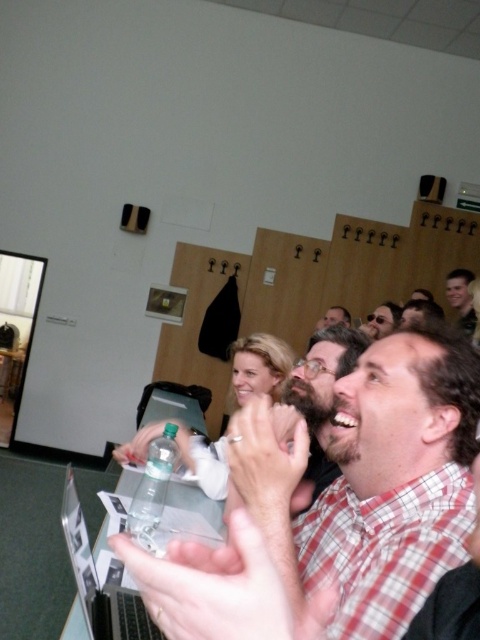
Question: Which of the following is the closest to the observer?

Choices:
 (A) (175, 483)
 (B) (376, 326)
 (C) (452, 307)

Answer: (A)

Question: Does silver metallic laptop at center have a greater width compared to light brown hair at upper right?

Choices:
 (A) yes
 (B) no

Answer: (B)

Question: Can you confirm if plaid shirt at center is smaller than matte black sunglasses at upper center?

Choices:
 (A) yes
 (B) no

Answer: (B)

Question: Which object appears closest to the camera in this image?

Choices:
 (A) silver metallic laptop at center
 (B) matte black sunglasses at upper center
 (C) plaid shirt at center

Answer: (C)

Question: Which object appears closest to the camera in this image?

Choices:
 (A) plaid shirt at center
 (B) silver metallic laptop at center

Answer: (A)

Question: Does plaid shirt at center appear under silver metallic laptop at center?

Choices:
 (A) yes
 (B) no

Answer: (B)